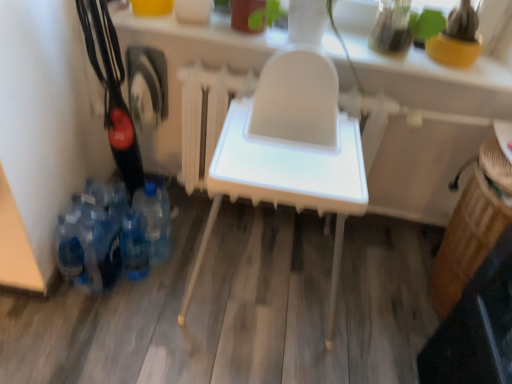
You are a GUI agent. You are given a task and a screenshot of the screen. Output one action in this format:
    pyautogui.click(x=<x>, y=<y>)
    Task: Click on the free point in front of blue plastic bottle at lower left, arranged as the first bottle when viewed from the right
    
    Given the screenshot: What is the action you would take?
    pyautogui.click(x=153, y=294)